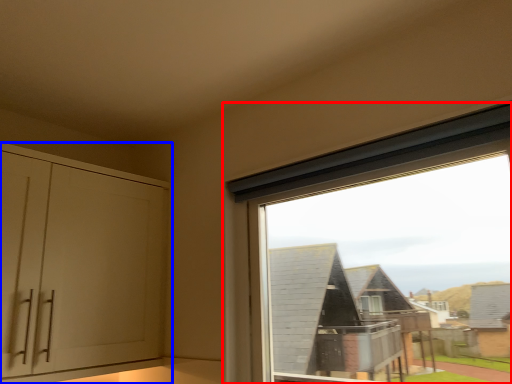
Question: Among these objects, which one is farthest to the camera, window (highlighted by a red box) or cabinetry (highlighted by a blue box)?

Choices:
 (A) window
 (B) cabinetry

Answer: (B)